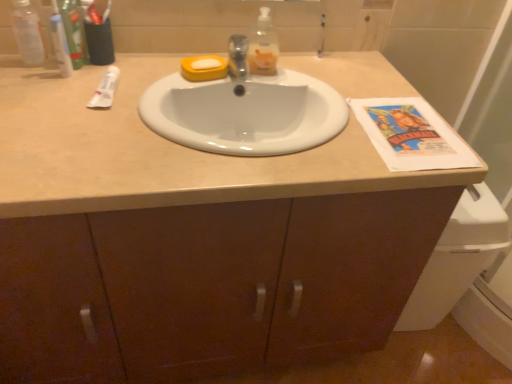
Locate an element on the screen. free space in front of transparent plastic bottle at upper left, acting as the 2th bottle starting from the right is located at coordinates (31, 88).